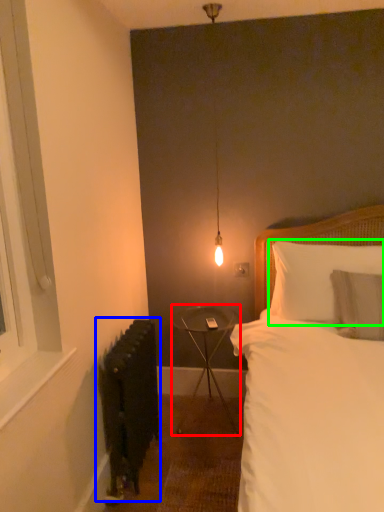
Question: Estimate the real-world distances between objects in this image. Which object is farther from table (highlighted by a red box), radiator (highlighted by a blue box) or pillow (highlighted by a green box)?

Choices:
 (A) radiator
 (B) pillow

Answer: (B)